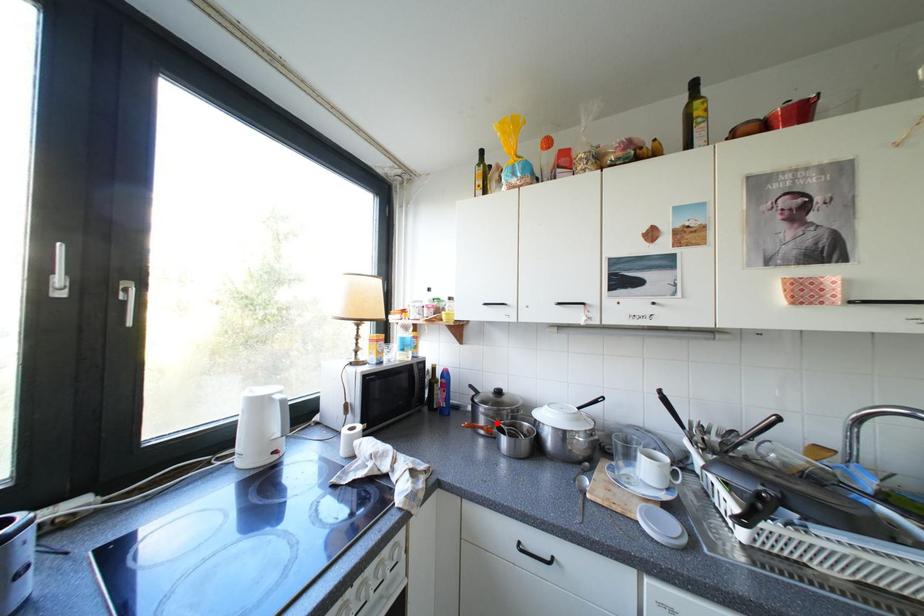
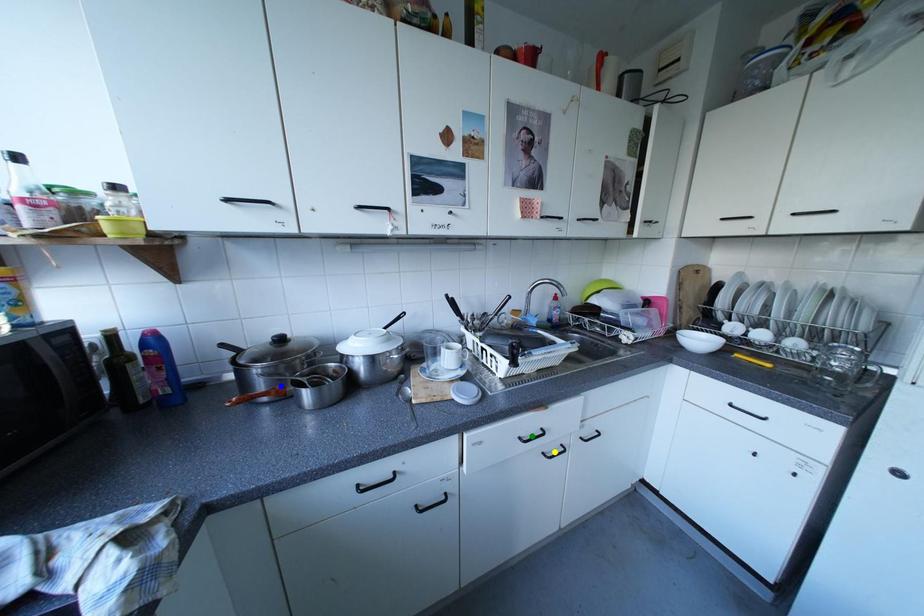
Question: I am providing you with two images of the same scene from different viewpoints. A red point is marked on the first image. You are given multiple points on the second image. Which mark in image 2 goes with the point in image 1?

Choices:
 (A) yellow point
 (B) green point
 (C) blue point

Answer: (C)